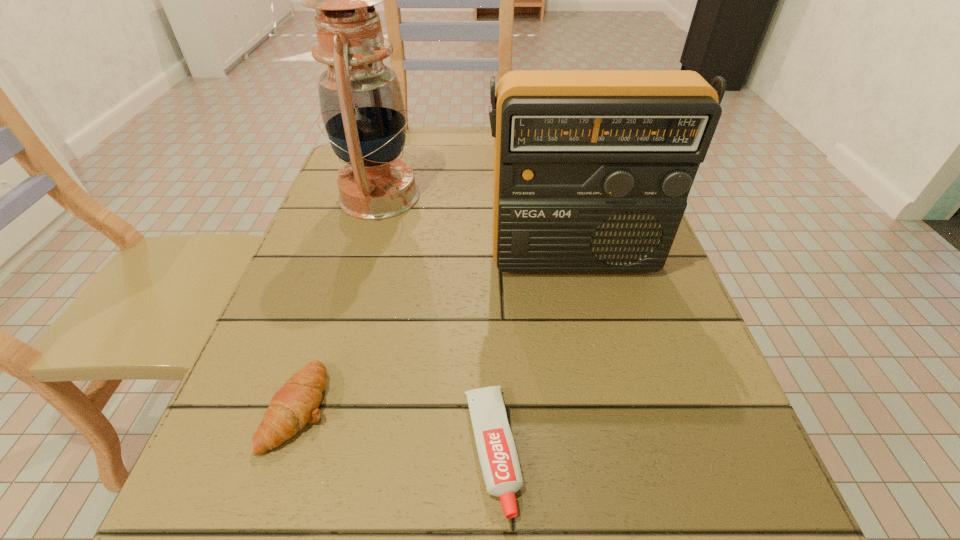
This screenshot has width=960, height=540. Identify the location of vacant space at the far left corner. (334, 193).

Where is `empty location between the toothpaste and the radio receiver`? empty location between the toothpaste and the radio receiver is located at coordinates (533, 355).

The height and width of the screenshot is (540, 960). Identify the location of vacant point located between the crescent roll and the radio receiver. (436, 333).

Find the location of a particular element. empty space that is in between the farthest object and the second farthest object is located at coordinates (476, 227).

Where is `free space between the shortest object and the crescent roll`? The height and width of the screenshot is (540, 960). free space between the shortest object and the crescent roll is located at coordinates (396, 429).

This screenshot has width=960, height=540. Identify the location of object that stands as the closest to the third tallest object. (496, 449).

Find the location of a particular element. This screenshot has width=960, height=540. object that stands as the third closest to the tallest object is located at coordinates (496, 449).

Where is `vacant space that satisfies the following two spatial constraints: 1. on the front side of the toothpaste; 2. on the right side of the farthest object`? vacant space that satisfies the following two spatial constraints: 1. on the front side of the toothpaste; 2. on the right side of the farthest object is located at coordinates (304, 451).